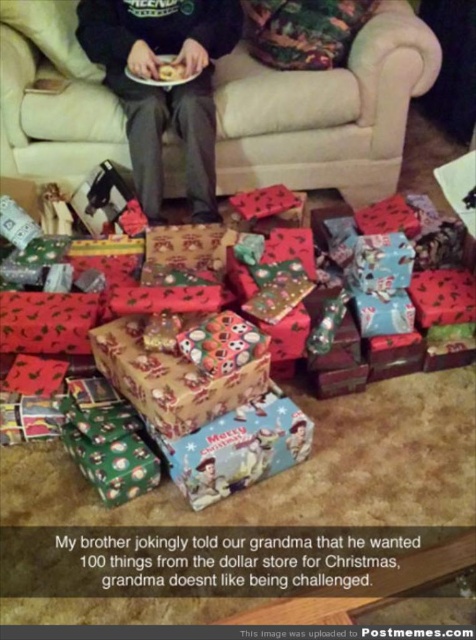
Which is below, beige fabric couch at upper center or black matte pants at center?

black matte pants at center

Who is shorter, beige fabric couch at upper center or black matte pants at center?

black matte pants at center is shorter.

Between point (355, 90) and point (137, 164), which one is positioned in front?

Point (137, 164) is more forward.

At what (x,y) coordinates should I click in order to perform the action: click on beige fabric couch at upper center. Please return your answer as a coordinate pair (x, y). This screenshot has width=476, height=640. Looking at the image, I should click on (326, 113).